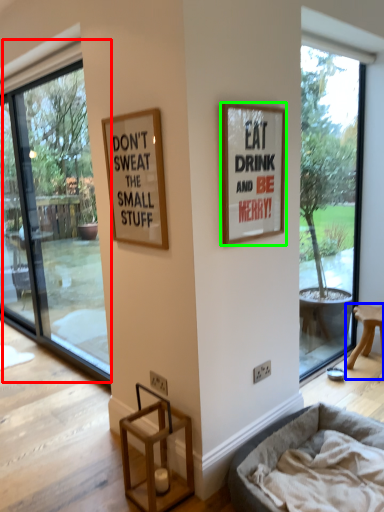
Question: Considering the real-world distances, which object is closest to window (highlighted by a red box)? furniture (highlighted by a blue box) or picture frame (highlighted by a green box).

Choices:
 (A) furniture
 (B) picture frame

Answer: (B)